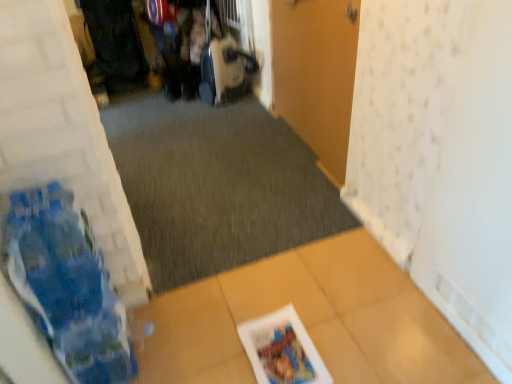
At what (x,y) coordinates should I click in order to perform the action: click on wooden door at center. Please return your answer as a coordinate pair (x, y). The image size is (512, 384). Looking at the image, I should click on (316, 73).

Describe the element at coordinates (282, 350) in the screenshot. I see `printed paper magazine at lower center` at that location.

Find the location of `dark gray carpet at center`. dark gray carpet at center is located at coordinates (217, 186).

Can you confirm if wooden door at center is positioned to the right of dark gray carpet at center?

Yes, wooden door at center is to the right of dark gray carpet at center.

Looking at this image, can we say wooden door at center lies outside dark gray carpet at center?

wooden door at center lies outside dark gray carpet at center's area.

Where is `door on the right of dark gray carpet at center`? door on the right of dark gray carpet at center is located at coordinates (316, 73).

What's the angular difference between wooden door at center and dark gray carpet at center's facing directions?

The facing directions of wooden door at center and dark gray carpet at center are 91.9 degrees apart.

Does point (122, 109) come behind point (269, 328)?

Yes, it is.

Considering the sizes of objects dark gray carpet at center and printed paper magazine at lower center in the image provided, who is smaller, dark gray carpet at center or printed paper magazine at lower center?

Smaller between the two is printed paper magazine at lower center.

Between dark gray carpet at center and printed paper magazine at lower center, which one has less height?

printed paper magazine at lower center.

From the image's perspective, which one is positioned lower, dark gray carpet at center or printed paper magazine at lower center?

printed paper magazine at lower center appears lower in the image.

In the image, is wooden door at center positioned in front of or behind printed paper magazine at lower center?

wooden door at center is positioned farther from the viewer than printed paper magazine at lower center.

Is the surface of wooden door at center in direct contact with printed paper magazine at lower center?

No, wooden door at center is not touching printed paper magazine at lower center.

From the image's perspective, between wooden door at center and printed paper magazine at lower center, who is located below?

printed paper magazine at lower center.

From their relative heights in the image, would you say wooden door at center is taller or shorter than printed paper magazine at lower center?

wooden door at center is taller than printed paper magazine at lower center.

Consider the image. Can you tell me how much dark gray carpet at center and wooden door at center differ in facing direction?

The facing directions of dark gray carpet at center and wooden door at center are 91.9 degrees apart.

Locate an element on the screen. door that appears on the right of dark gray carpet at center is located at coordinates (316, 73).

Considering the sizes of objects dark gray carpet at center and wooden door at center in the image provided, who is thinner, dark gray carpet at center or wooden door at center?

wooden door at center.

Considering the relative positions of dark gray carpet at center and wooden door at center in the image provided, is dark gray carpet at center to the left or to the right of wooden door at center?

Based on their positions, dark gray carpet at center is located to the left of wooden door at center.

From the image's perspective, is printed paper magazine at lower center under dark gray carpet at center?

Correct, printed paper magazine at lower center appears lower than dark gray carpet at center in the image.

Considering the relative positions of printed paper magazine at lower center and dark gray carpet at center in the image provided, is printed paper magazine at lower center behind dark gray carpet at center?

That is False.

Which point is more forward, (262,322) or (148,191)?

Point (262,322)

You are a GUI agent. You are given a task and a screenshot of the screen. Output one action in this format:
    pyautogui.click(x=<x>, y=<y>)
    Task: Click on the magazine on the right of dark gray carpet at center
    This screenshot has width=512, height=384.
    Given the screenshot: What is the action you would take?
    pyautogui.click(x=282, y=350)

How distant is printed paper magazine at lower center from wooden door at center?

They are 3.30 feet apart.

Is printed paper magazine at lower center completely or partially outside of wooden door at center?

That's correct, printed paper magazine at lower center is outside of wooden door at center.

From the image's perspective, between printed paper magazine at lower center and wooden door at center, which one is located above?

wooden door at center appears higher in the image.

The image size is (512, 384). I want to click on plain that appears behind the wooden door at center, so click(217, 186).

Locate an element on the screen. The image size is (512, 384). plain on the left side of printed paper magazine at lower center is located at coordinates (217, 186).

From the image, which object appears to be farther from dark gray carpet at center, printed paper magazine at lower center or wooden door at center?

The object further to dark gray carpet at center is printed paper magazine at lower center.

When comparing their distances from wooden door at center, does printed paper magazine at lower center or dark gray carpet at center seem closer?

dark gray carpet at center.

From the image, which object appears to be farther from wooden door at center, dark gray carpet at center or printed paper magazine at lower center?

Among the two, printed paper magazine at lower center is located further to wooden door at center.

Considering their positions, is dark gray carpet at center positioned closer to printed paper magazine at lower center than wooden door at center?

dark gray carpet at center is positioned closer to the anchor printed paper magazine at lower center.

Considering their positions, is wooden door at center positioned closer to dark gray carpet at center than printed paper magazine at lower center?

The object closer to dark gray carpet at center is wooden door at center.

Looking at this image, estimate the real-world distances between objects in this image. Which object is closer to printed paper magazine at lower center, wooden door at center or dark gray carpet at center?

dark gray carpet at center is positioned closer to the anchor printed paper magazine at lower center.

Find the location of `plain between wooden door at center and printed paper magazine at lower center vertically`. plain between wooden door at center and printed paper magazine at lower center vertically is located at coordinates (217, 186).